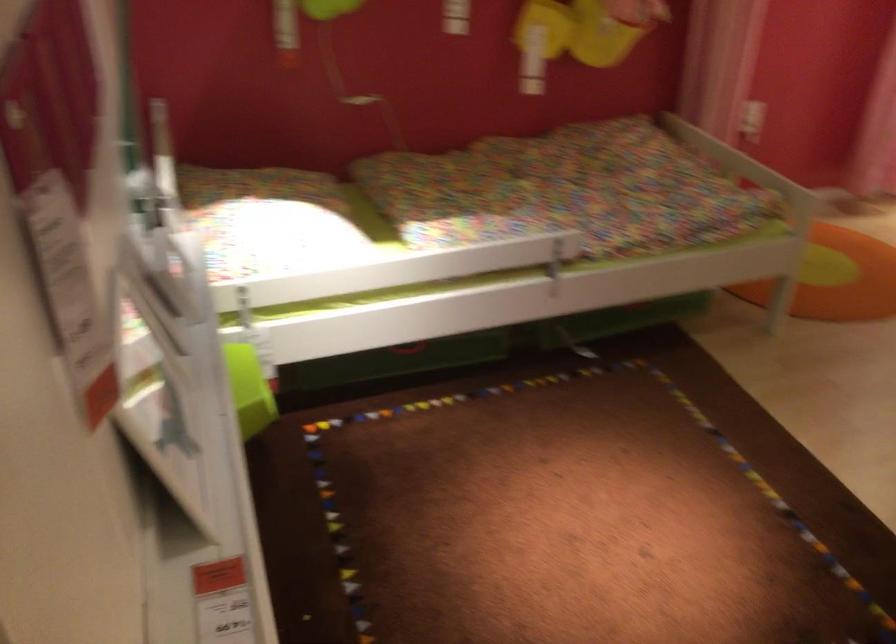
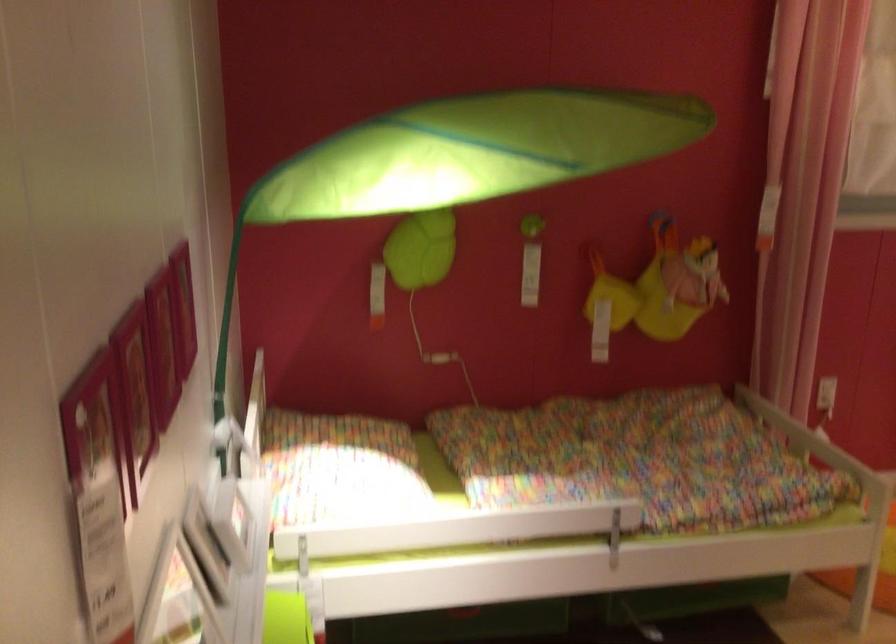
Locate, in the second image, the point that corresponds to (264,218) in the first image.

(339, 468)